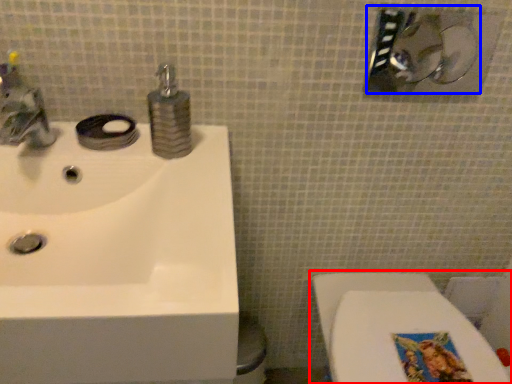
Question: Which of the following is the closest to the observer, toilet (highlighted by a red box) or shower (highlighted by a blue box)?

Choices:
 (A) toilet
 (B) shower

Answer: (B)